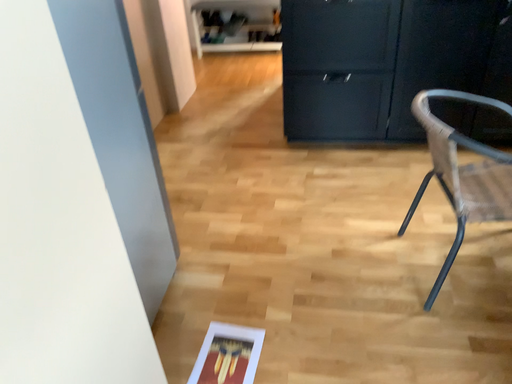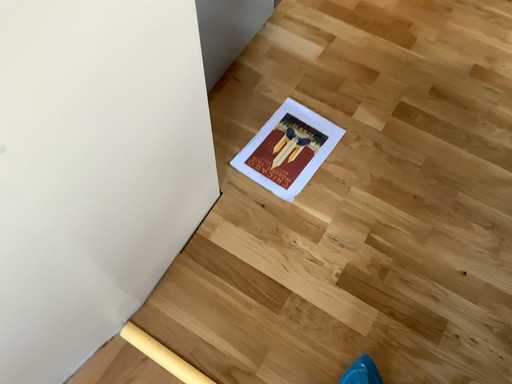
Question: Which way did the camera rotate in the video?

Choices:
 (A) rotated right
 (B) rotated left

Answer: (B)